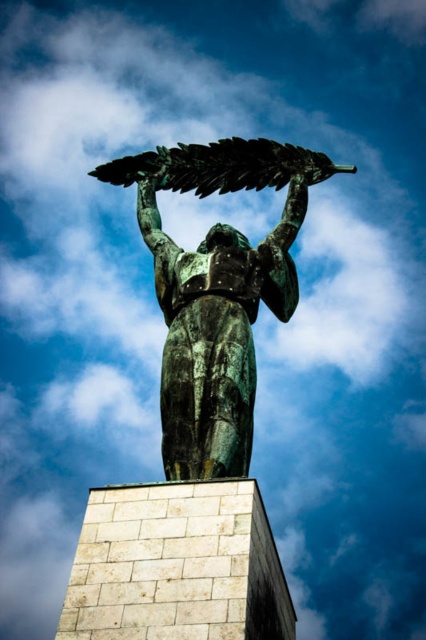
You are an art conservator assessing the statue. You notice the bronze statue at center and the green patina leaf at upper center. Which object is positioned higher in the image?

The green patina leaf at upper center is higher than the bronze statue at center.